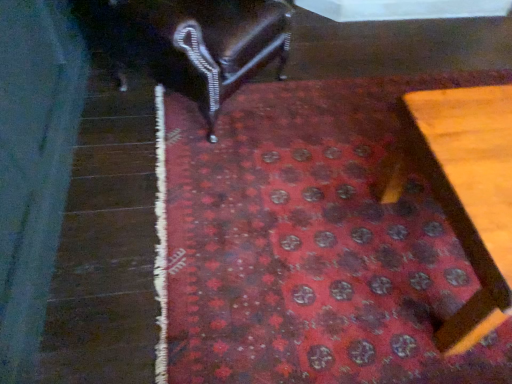
Question: Does wooden table at lower right, the second furniture in the left-to-right sequence, have a smaller size compared to red carpet at center?

Choices:
 (A) yes
 (B) no

Answer: (B)

Question: Would you consider wooden table at lower right, the 1th furniture in the bottom-to-top sequence, to be distant from red carpet at center?

Choices:
 (A) yes
 (B) no

Answer: (B)

Question: From the image's perspective, is wooden table at lower right, which appears as the second furniture when viewed from the top, on red carpet at center?

Choices:
 (A) no
 (B) yes

Answer: (A)

Question: Is wooden table at lower right, the second furniture in the left-to-right sequence, next to red carpet at center and touching it?

Choices:
 (A) yes
 (B) no

Answer: (B)

Question: Can you confirm if wooden table at lower right, which appears as the second furniture when viewed from the top, is shorter than red carpet at center?

Choices:
 (A) no
 (B) yes

Answer: (A)

Question: From a real-world perspective, is wooden table at lower right, which appears as the second furniture when viewed from the top, below red carpet at center?

Choices:
 (A) no
 (B) yes

Answer: (A)

Question: Is wooden table at lower right, arranged as the first furniture when viewed from the right, smaller than shiny dark wood chair at upper left, arranged as the 1th furniture when viewed from the top?

Choices:
 (A) no
 (B) yes

Answer: (B)

Question: Does wooden table at lower right, which appears as the second furniture when viewed from the top, turn towards shiny dark wood chair at upper left, arranged as the 1th furniture when viewed from the top?

Choices:
 (A) no
 (B) yes

Answer: (A)

Question: Is wooden table at lower right, the second furniture in the left-to-right sequence, located outside shiny dark wood chair at upper left, positioned as the 2th furniture in right-to-left order?

Choices:
 (A) no
 (B) yes

Answer: (B)

Question: Does wooden table at lower right, the second furniture in the left-to-right sequence, appear on the right side of shiny dark wood chair at upper left, arranged as the 1th furniture when viewed from the top?

Choices:
 (A) no
 (B) yes

Answer: (B)

Question: Does wooden table at lower right, the 1th furniture in the bottom-to-top sequence, have a greater width compared to shiny dark wood chair at upper left, placed as the first furniture when sorted from left to right?

Choices:
 (A) no
 (B) yes

Answer: (A)

Question: Does wooden table at lower right, the 1th furniture in the bottom-to-top sequence, have a larger size compared to shiny dark wood chair at upper left, placed as the first furniture when sorted from left to right?

Choices:
 (A) yes
 (B) no

Answer: (B)

Question: From the image's perspective, is red carpet at center over shiny dark wood chair at upper left, positioned as the 2th furniture in right-to-left order?

Choices:
 (A) yes
 (B) no

Answer: (B)